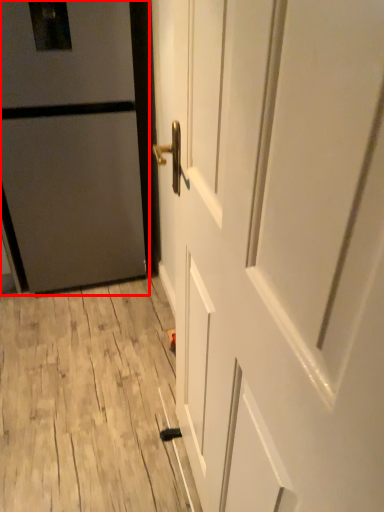
Question: From the image's perspective, where is door (annotated by the red box) located relative to door?

Choices:
 (A) below
 (B) above

Answer: (B)